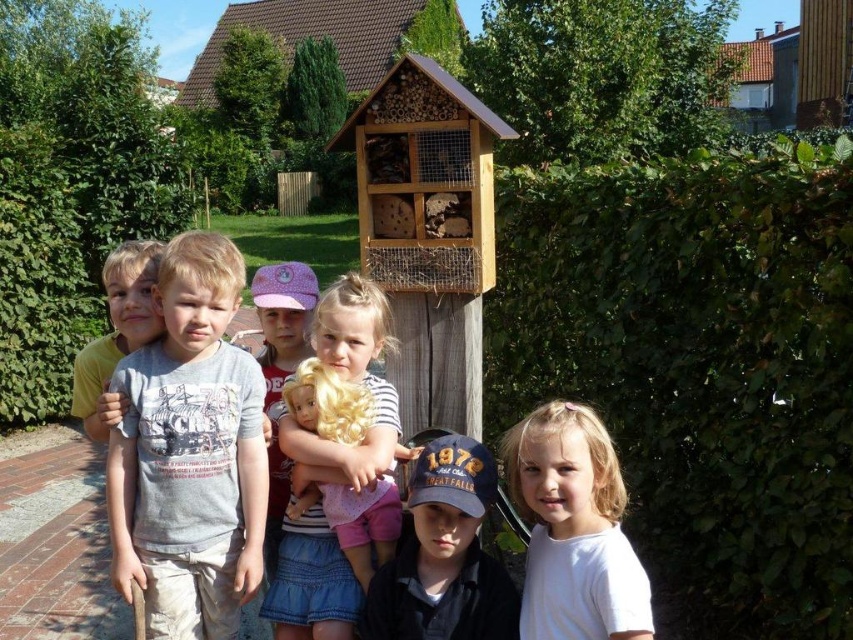
Can you confirm if gray cotton shirt at center is shorter than white matte shirt at center?

Incorrect, gray cotton shirt at center's height does not fall short of white matte shirt at center's.

Between gray cotton shirt at center and white matte shirt at center, which one has less height?

white matte shirt at center is shorter.

The height and width of the screenshot is (640, 853). What do you see at coordinates (190, 452) in the screenshot?
I see `gray cotton shirt at center` at bounding box center [190, 452].

Where is `gray cotton shirt at center`? The image size is (853, 640). gray cotton shirt at center is located at coordinates (190, 452).

The image size is (853, 640). What do you see at coordinates (190, 452) in the screenshot? I see `gray cotton shirt at center` at bounding box center [190, 452].

Between gray cotton shirt at center and matte blonde wig at center, which one appears on the left side from the viewer's perspective?

gray cotton shirt at center

Who is more forward, (209, 545) or (390, 550)?

Positioned in front is point (209, 545).

The image size is (853, 640). In order to click on gray cotton shirt at center in this screenshot , I will do `click(190, 452)`.

Between matte blonde wig at center and light brown hair at center, which one has less height?

light brown hair at center is shorter.

Can you confirm if matte blonde wig at center is smaller than light brown hair at center?

No.

Which is in front, point (387, 461) or point (109, 372)?

Point (387, 461)

At what (x,y) coordinates should I click in order to perform the action: click on matte blonde wig at center. Please return your answer as a coordinate pair (x, y). The height and width of the screenshot is (640, 853). Looking at the image, I should click on (363, 429).